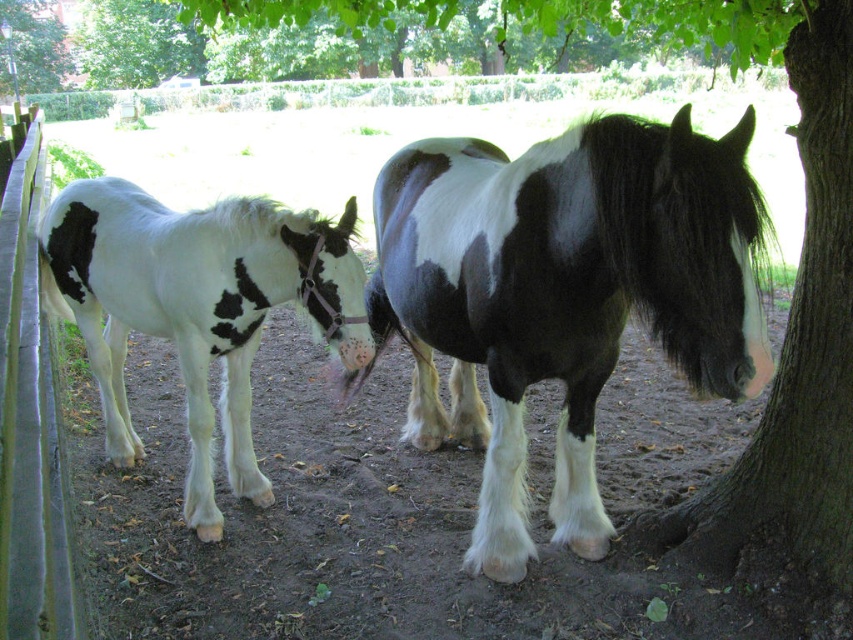
You are standing in front of the two horses and want to place a small treat between them. The treat must be placed exactly halfway between point A at point (508, 486) and point B at point (7, 173). Which horse is closer to the treat?

The treat placed halfway between point A at point (508, 486) and point B at point (7, 173) will be closer to the smaller horse on the left because point A is closer to the viewer than point B. Since the smaller horse is near point A, the treat would be closer to it.